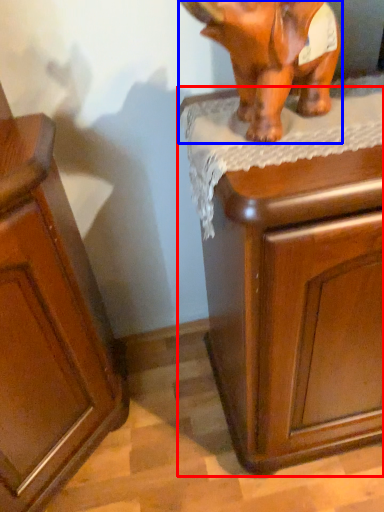
Question: Which object appears closest to the camera in this image, chest of drawers (highlighted by a red box) or elephant (highlighted by a blue box)?

Choices:
 (A) chest of drawers
 (B) elephant

Answer: (B)